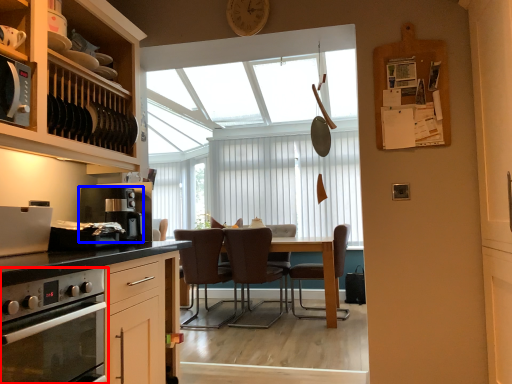
Question: Which point is closer to the camera, home appliance (highlighted by a red box) or kitchen appliance (highlighted by a blue box)?

Choices:
 (A) home appliance
 (B) kitchen appliance

Answer: (A)